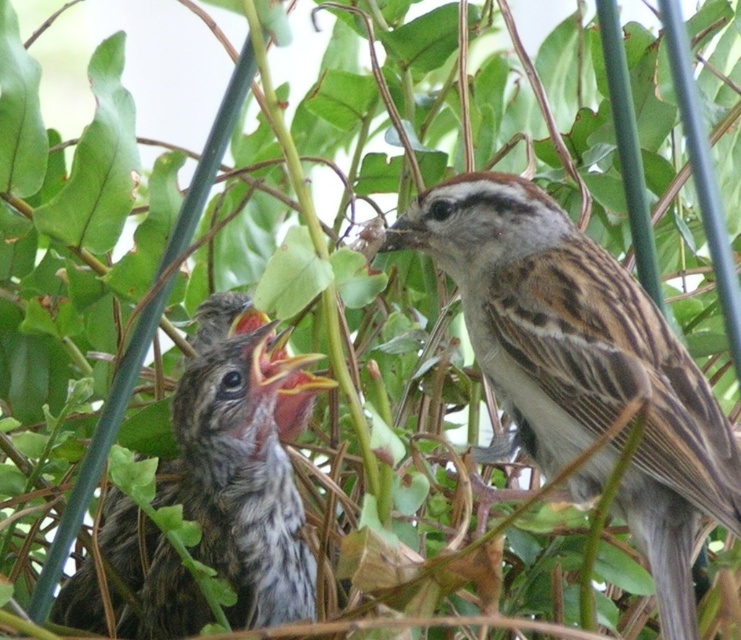
You are a birdwatcher observing the scene. You notice the brown speckled feathers at upper right and the speckled brown sparrow at center. Which object is positioned higher in the image?

The brown speckled feathers at upper right are positioned higher in the image than the speckled brown sparrow at center because the description states that the brown speckled feathers at upper right is much taller as speckled brown sparrow at center.

You are a birdwatcher observing the scene. You notice the brown speckled feathers at upper right and the speckled brown sparrow at center. Which object is wider in this image?

The brown speckled feathers at upper right might be wider than the speckled brown sparrow at center.

You are a birdwatcher observing the two points of interest in the image. Which point is closer to you, point (725, 522) or point (279, 420)?

Point (725, 522) is in front of point (279, 420), so it is closer to you.